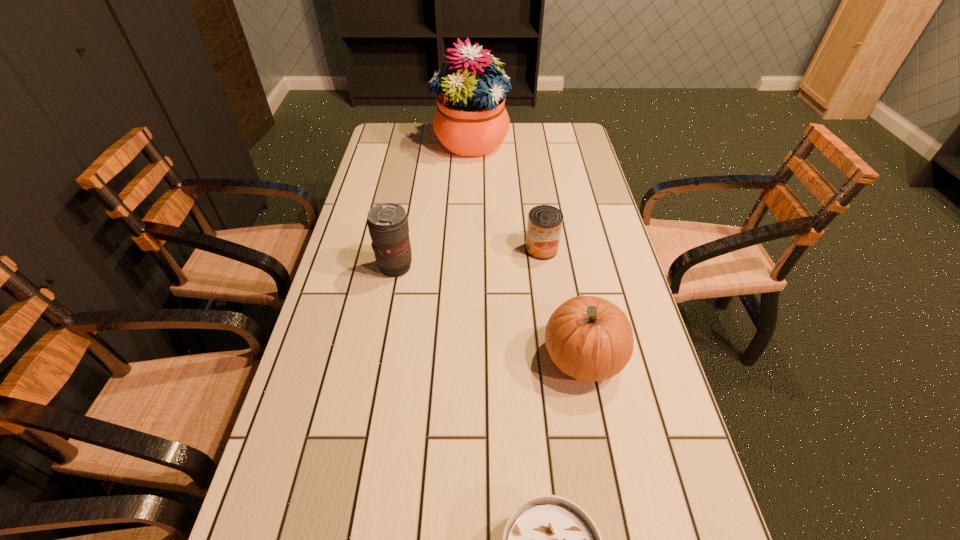
This screenshot has width=960, height=540. I want to click on free location located 0.310m on the front of the fourth tallest object, so click(556, 350).

This screenshot has height=540, width=960. In order to click on object that is at the far edge in this screenshot , I will do `click(470, 120)`.

This screenshot has width=960, height=540. In order to click on object positioned at the left edge in this screenshot , I will do `click(388, 226)`.

This screenshot has height=540, width=960. I want to click on object at the right edge, so click(x=589, y=338).

Identify the location of free space at the left edge. This screenshot has height=540, width=960. tap(321, 340).

The image size is (960, 540). What are the coordinates of `vacant space at the right edge of the desktop` in the screenshot? It's located at (572, 195).

The image size is (960, 540). In the image, there is a desktop. What are the coordinates of `vacant space at the far left corner` in the screenshot? It's located at (392, 146).

I want to click on vacant space at the far right corner of the desktop, so click(x=566, y=129).

You are a GUI agent. You are given a task and a screenshot of the screen. Output one action in this format:
    pyautogui.click(x=<x>, y=<y>)
    Task: Click on the blank region between the second nearest object and the can
    
    Given the screenshot: What is the action you would take?
    pyautogui.click(x=563, y=303)

Image resolution: width=960 pixels, height=540 pixels. In order to click on free point between the fourth tallest object and the flower arrangement in this screenshot , I will do `click(506, 196)`.